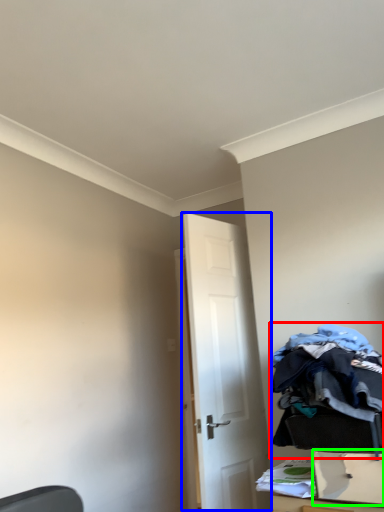
Question: Which object is positioned closest to laundry (highlighted by a red box)? Select from door (highlighted by a blue box) and drawer (highlighted by a green box).

Choices:
 (A) door
 (B) drawer

Answer: (B)